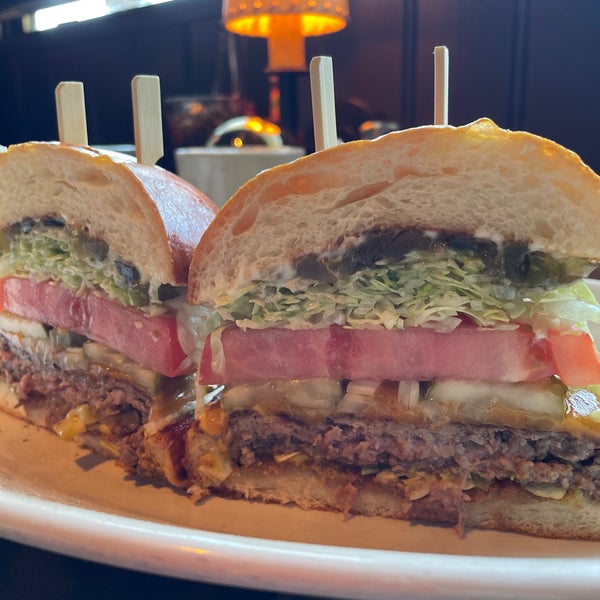
Find the location of a particular element. light fixture is located at coordinates (279, 25).